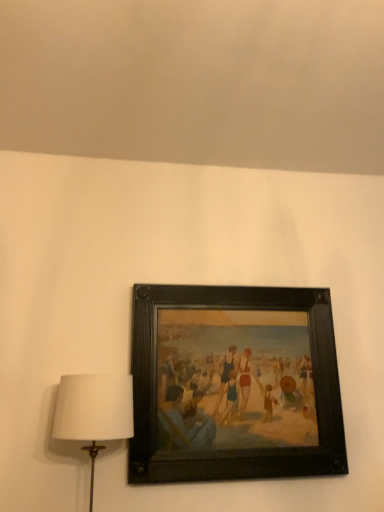
The width and height of the screenshot is (384, 512). What are the coordinates of `white fabric lampshade at left` in the screenshot? It's located at (94, 412).

The height and width of the screenshot is (512, 384). What do you see at coordinates (94, 412) in the screenshot?
I see `white fabric lampshade at left` at bounding box center [94, 412].

What do you see at coordinates (234, 384) in the screenshot? I see `wooden picture frame at center` at bounding box center [234, 384].

Image resolution: width=384 pixels, height=512 pixels. I want to click on wooden picture frame at center, so click(234, 384).

At what (x,y) coordinates should I click in order to perform the action: click on white fabric lampshade at left. Please return your answer as a coordinate pair (x, y). This screenshot has width=384, height=512. Looking at the image, I should click on (94, 412).

Is white fabric lampshade at left to the right of wooden picture frame at center from the viewer's perspective?

No, white fabric lampshade at left is not to the right of wooden picture frame at center.

Is white fabric lampshade at left closer to the viewer compared to wooden picture frame at center?

Yes, white fabric lampshade at left is in front of wooden picture frame at center.

Which point is more distant from viewer, [100,412] or [326,471]?

Point [326,471]

From the image's perspective, which object appears higher, white fabric lampshade at left or wooden picture frame at center?

wooden picture frame at center appears higher in the image.

From a real-world perspective, which object rests below the other?

white fabric lampshade at left.

Can you confirm if white fabric lampshade at left is wider than wooden picture frame at center?

Yes.

In terms of height, does white fabric lampshade at left look taller or shorter compared to wooden picture frame at center?

In the image, white fabric lampshade at left appears to be shorter than wooden picture frame at center.

Does white fabric lampshade at left have a larger size compared to wooden picture frame at center?

No, white fabric lampshade at left is not bigger than wooden picture frame at center.

Could wooden picture frame at center be considered to be inside white fabric lampshade at left?

No.

Is white fabric lampshade at left touching wooden picture frame at center?

white fabric lampshade at left and wooden picture frame at center are clearly separated.

Is white fabric lampshade at left facing towards wooden picture frame at center?

No, white fabric lampshade at left is not aimed at wooden picture frame at center.

Can you tell me how much white fabric lampshade at left and wooden picture frame at center differ in facing direction?

They differ by 0.058 degrees in their facing directions.

Measure the distance between white fabric lampshade at left and wooden picture frame at center.

The distance of white fabric lampshade at left from wooden picture frame at center is 13.61 inches.

Identify the location of picture frame above the white fabric lampshade at left (from the image's perspective). [234, 384].

Considering the relative positions of wooden picture frame at center and white fabric lampshade at left in the image provided, is wooden picture frame at center to the left or to the right of white fabric lampshade at left?

Clearly, wooden picture frame at center is on the right of white fabric lampshade at left in the image.

Between wooden picture frame at center and white fabric lampshade at left, which one is positioned behind?

wooden picture frame at center is further away from the camera.

Which point is more distant from viewer, (247, 330) or (66, 413)?

Point (247, 330)

From the image's perspective, is wooden picture frame at center on top of white fabric lampshade at left?

Correct, wooden picture frame at center appears higher than white fabric lampshade at left in the image.

From a real-world perspective, between wooden picture frame at center and white fabric lampshade at left, who is vertically higher?

wooden picture frame at center, from a real-world perspective.

Between wooden picture frame at center and white fabric lampshade at left, which one has larger width?

white fabric lampshade at left is wider.

Which of these two, wooden picture frame at center or white fabric lampshade at left, stands shorter?

white fabric lampshade at left is shorter.

Does wooden picture frame at center have a larger size compared to white fabric lampshade at left?

Indeed, wooden picture frame at center has a larger size compared to white fabric lampshade at left.

Choose the correct answer: Is wooden picture frame at center inside white fabric lampshade at left or outside it?

wooden picture frame at center cannot be found inside white fabric lampshade at left.

Is wooden picture frame at center far away from white fabric lampshade at left?

No, wooden picture frame at center is not far away from white fabric lampshade at left.

Could you tell me if wooden picture frame at center is turned towards white fabric lampshade at left?

No, wooden picture frame at center is not turned towards white fabric lampshade at left.

How different are the orientations of wooden picture frame at center and white fabric lampshade at left in degrees?

0.058 degrees.

Where is `lamp lying on the left of wooden picture frame at center`? The width and height of the screenshot is (384, 512). lamp lying on the left of wooden picture frame at center is located at coordinates (94, 412).

Where is `picture frame behind the white fabric lampshade at left`? The height and width of the screenshot is (512, 384). picture frame behind the white fabric lampshade at left is located at coordinates (234, 384).

Image resolution: width=384 pixels, height=512 pixels. In order to click on picture frame that appears on the right of white fabric lampshade at left in this screenshot , I will do `click(234, 384)`.